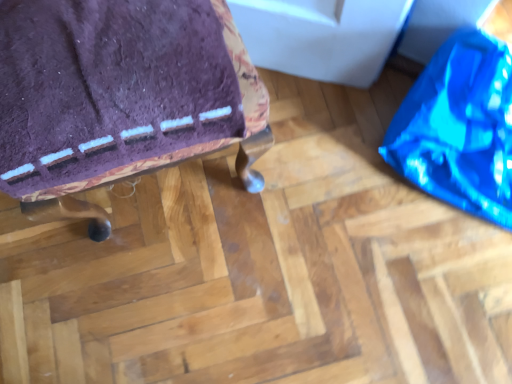
Locate an element on the screen. The width and height of the screenshot is (512, 384). free spot in front of purple fabric cushion at upper left is located at coordinates click(x=168, y=299).